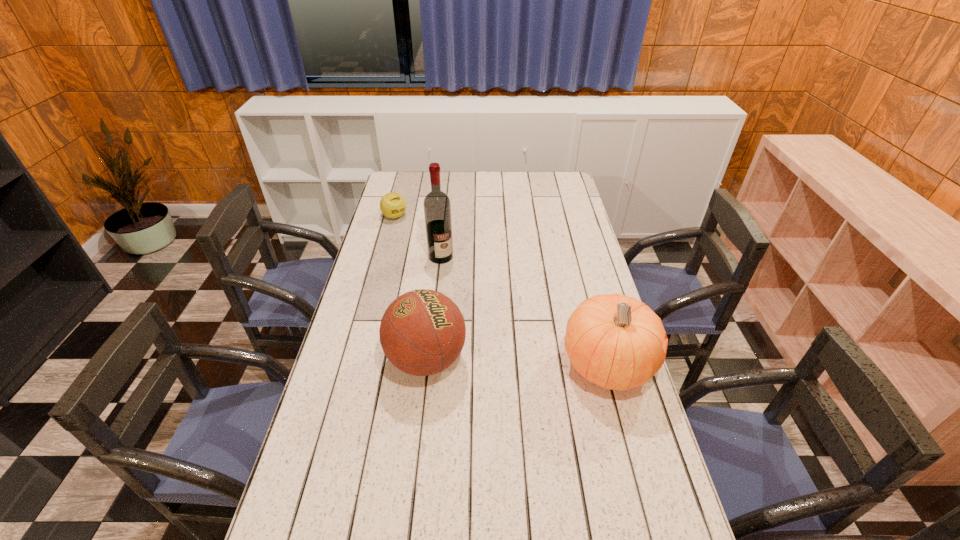
Identify the location of free space located on the logo side of the softball. The image size is (960, 540). (430, 253).

Find the location of a particular element. The image size is (960, 540). free location located on the logo side of the softball is located at coordinates tap(420, 241).

Identify the location of free space located on the logo side of the softball. This screenshot has height=540, width=960. (416, 238).

Where is `basketball at the left edge`? basketball at the left edge is located at coordinates (422, 332).

Where is `softball that is at the left edge`? The width and height of the screenshot is (960, 540). softball that is at the left edge is located at coordinates (393, 205).

The image size is (960, 540). In order to click on object at the right edge in this screenshot , I will do `click(617, 342)`.

Locate an element on the screen. The width and height of the screenshot is (960, 540). vacant space at the far edge of the desktop is located at coordinates pos(429,178).

Locate an element on the screen. vacant space at the left edge is located at coordinates (377, 237).

The image size is (960, 540). In order to click on free space at the right edge of the desktop in this screenshot , I will do `click(598, 470)`.

Image resolution: width=960 pixels, height=540 pixels. Find the location of `free region at the far right corner of the desktop`. free region at the far right corner of the desktop is located at coordinates (549, 192).